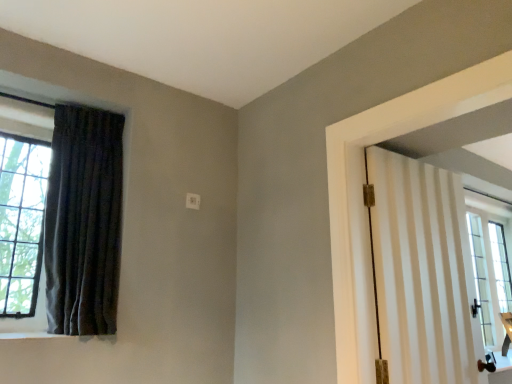
What do you see at coordinates (423, 272) in the screenshot?
I see `white striped door at right` at bounding box center [423, 272].

The image size is (512, 384). Identify the location of white striped door at right. (423, 272).

This screenshot has height=384, width=512. Find the location of `dark velvet curtain at left`. dark velvet curtain at left is located at coordinates (84, 221).

The width and height of the screenshot is (512, 384). Describe the element at coordinates (84, 221) in the screenshot. I see `dark velvet curtain at left` at that location.

Measure the distance between dark velvet curtain at left and camera.

dark velvet curtain at left and camera are 6.07 feet apart.

Find the location of `white striped door at right`. white striped door at right is located at coordinates (423, 272).

From the picture: Considering the positions of objects dark velvet curtain at left and white striped door at right in the image provided, who is more to the left, dark velvet curtain at left or white striped door at right?

dark velvet curtain at left.

Which object is closer to the camera, dark velvet curtain at left or white striped door at right?

white striped door at right is more forward.

Is point (110, 178) in front of point (458, 229)?

Yes, point (110, 178) is closer to viewer.

From the image's perspective, does dark velvet curtain at left appear lower than white striped door at right?

No.

From a real-world perspective, relative to white striped door at right, is dark velvet curtain at left vertically above or below?

From a real-world perspective, dark velvet curtain at left is physically above white striped door at right.

Between dark velvet curtain at left and white striped door at right, which one has smaller width?

With smaller width is white striped door at right.

Is dark velvet curtain at left shorter than white striped door at right?

In fact, dark velvet curtain at left may be taller than white striped door at right.

Who is smaller, dark velvet curtain at left or white striped door at right?

white striped door at right.

Would you say dark velvet curtain at left is outside white striped door at right?

Yes, dark velvet curtain at left is located beyond the bounds of white striped door at right.

Can you see dark velvet curtain at left touching white striped door at right?

There is a gap between dark velvet curtain at left and white striped door at right.

Is dark velvet curtain at left turned away from white striped door at right?

No.

How different are the orientations of dark velvet curtain at left and white striped door at right in degrees?

2.4 degrees separate the facing orientations of dark velvet curtain at left and white striped door at right.

How much distance is there between dark velvet curtain at left and white striped door at right?

The distance of dark velvet curtain at left from white striped door at right is 1.42 meters.

The height and width of the screenshot is (384, 512). In order to click on door to the right of dark velvet curtain at left in this screenshot , I will do `click(423, 272)`.

In the scene shown: Considering the relative positions of white striped door at right and dark velvet curtain at left in the image provided, is white striped door at right to the left of dark velvet curtain at left from the viewer's perspective?

No, white striped door at right is not to the left of dark velvet curtain at left.

Is white striped door at right behind dark velvet curtain at left?

No, white striped door at right is closer to the camera.

Does point (397, 161) come behind point (114, 289)?

Yes.

From the image's perspective, which one is positioned lower, white striped door at right or dark velvet curtain at left?

From the image's view, white striped door at right is below.

From a real-world perspective, which object rests below the other?

white striped door at right, from a real-world perspective.

Can you confirm if white striped door at right is wider than dark velvet curtain at left?

In fact, white striped door at right might be narrower than dark velvet curtain at left.

Who is shorter, white striped door at right or dark velvet curtain at left?

With less height is white striped door at right.

Considering the relative sizes of white striped door at right and dark velvet curtain at left in the image provided, is white striped door at right bigger than dark velvet curtain at left?

Actually, white striped door at right might be smaller than dark velvet curtain at left.

Is white striped door at right situated inside dark velvet curtain at left or outside?

white striped door at right is not enclosed by dark velvet curtain at left.

Can you see white striped door at right touching dark velvet curtain at left?

white striped door at right and dark velvet curtain at left are not in contact.

Is dark velvet curtain at left at the back of white striped door at right?

No, white striped door at right is not facing away from dark velvet curtain at left.

You are a GUI agent. You are given a task and a screenshot of the screen. Output one action in this format:
    pyautogui.click(x=<x>, y=<y>)
    Task: Click on the door below the dark velvet curtain at left (from the image's perspective)
    
    Given the screenshot: What is the action you would take?
    pyautogui.click(x=423, y=272)

Where is `door in front of the dark velvet curtain at left`? This screenshot has width=512, height=384. door in front of the dark velvet curtain at left is located at coordinates (423, 272).

Locate an element on the screen. The height and width of the screenshot is (384, 512). curtain above the white striped door at right (from a real-world perspective) is located at coordinates (84, 221).